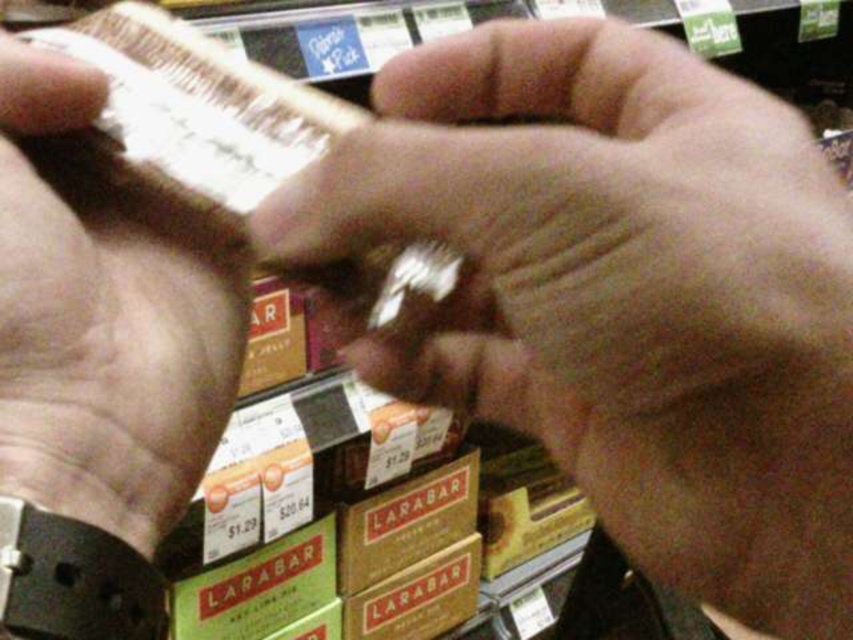
You are a delivery person who needs to place a new Larabar box on the shelf. The box must be placed at one of the two points specified by the coordinates point (763, 312) and point (199, 422). Which point is closer to the camera so that the box will be more visible to customers?

Point (763, 312) is closer to the camera than point (199, 422), so placing the box there will make it more visible to customers.

You are a cashier at a grocery store and need to scan the barcode on the shelf. The barcode is located at the point represented by point (x=624, y=294). Can you reach it with the barcode scanner, considering the position of the matte plastic hand at center?

The matte plastic hand at center is represented by point (x=624, y=294), so the barcode scanner cannot reach the barcode because it is already occupied by the hand.

You are trying to pick up the smooth brown leather wallet at left from the shelf but there is a matte plastic hand at center in the way. Can you reach the wallet without moving the hand?

The matte plastic hand at center is larger in size than smooth brown leather wallet at left, so it might block access to the wallet. You should move the hand to reach the wallet.